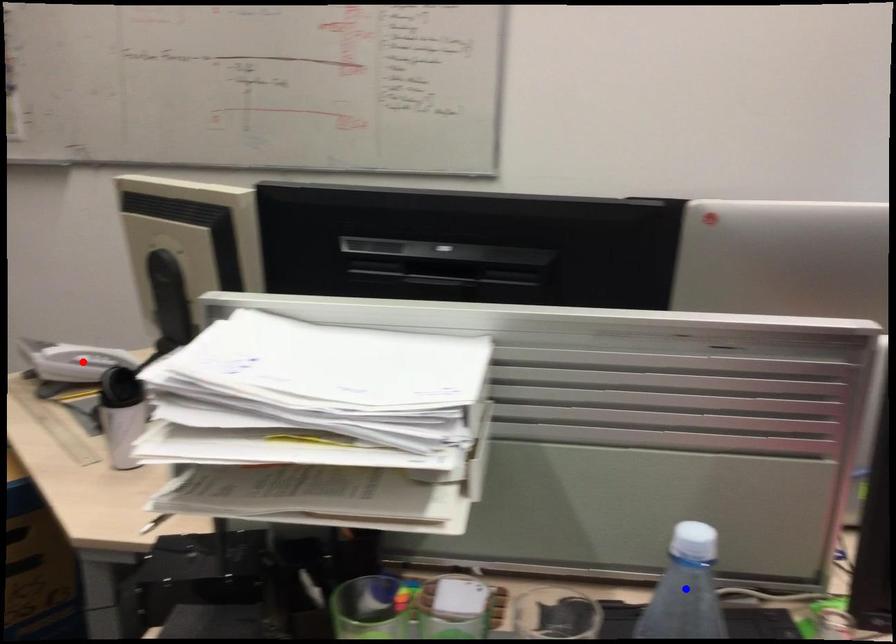
Question: In the image, two points are highlighted. Which point is nearer to the camera? Reply with the corresponding letter.

Choices:
 (A) blue point
 (B) red point

Answer: (A)